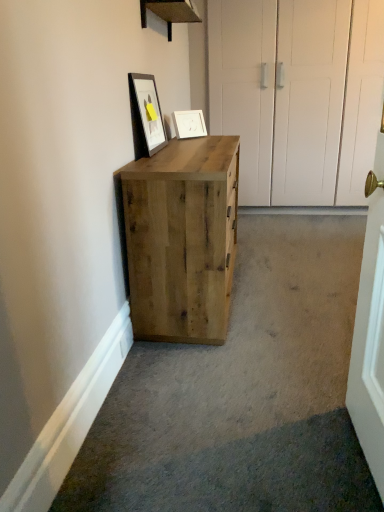
Question: Considering the relative sizes of matte black picture frame at upper center, the second picture frame viewed from the right, and natural wood cabinet at center in the image provided, is matte black picture frame at upper center, the second picture frame viewed from the right, thinner than natural wood cabinet at center?

Choices:
 (A) no
 (B) yes

Answer: (B)

Question: Is matte black picture frame at upper center, the second picture frame from the back, at the right side of natural wood cabinet at center?

Choices:
 (A) yes
 (B) no

Answer: (B)

Question: Is matte black picture frame at upper center, the second picture frame from the back, not inside natural wood cabinet at center?

Choices:
 (A) no
 (B) yes

Answer: (B)

Question: Is matte black picture frame at upper center, which is the first picture frame from left to right, positioned far away from natural wood cabinet at center?

Choices:
 (A) yes
 (B) no

Answer: (B)

Question: From a real-world perspective, is matte black picture frame at upper center, which is the first picture frame from left to right, on top of natural wood cabinet at center?

Choices:
 (A) yes
 (B) no

Answer: (A)

Question: Considering the relative sizes of matte black picture frame at upper center, the second picture frame from the back, and natural wood cabinet at center in the image provided, is matte black picture frame at upper center, the second picture frame from the back, shorter than natural wood cabinet at center?

Choices:
 (A) no
 (B) yes

Answer: (B)

Question: Would you consider white matte picture frame at upper center, the 1th picture frame from the back, to be distant from natural wood cabinet at center?

Choices:
 (A) yes
 (B) no

Answer: (B)

Question: Is white matte picture frame at upper center, the 1th picture frame from the back, positioned behind natural wood cabinet at center?

Choices:
 (A) yes
 (B) no

Answer: (A)

Question: Does white matte picture frame at upper center, the 1th picture frame positioned from the right, have a lesser width compared to natural wood cabinet at center?

Choices:
 (A) yes
 (B) no

Answer: (A)

Question: Is white matte picture frame at upper center, the 1th picture frame from the back, wider than natural wood cabinet at center?

Choices:
 (A) yes
 (B) no

Answer: (B)

Question: Is white matte picture frame at upper center, the 2th picture frame in the front-to-back sequence, shorter than natural wood cabinet at center?

Choices:
 (A) no
 (B) yes

Answer: (B)

Question: From a real-world perspective, is white matte picture frame at upper center, the second picture frame viewed from the left, below natural wood cabinet at center?

Choices:
 (A) yes
 (B) no

Answer: (B)

Question: Is matte black picture frame at upper center, the second picture frame viewed from the right, inside white matte picture frame at upper center, the 1th picture frame positioned from the right?

Choices:
 (A) no
 (B) yes

Answer: (A)